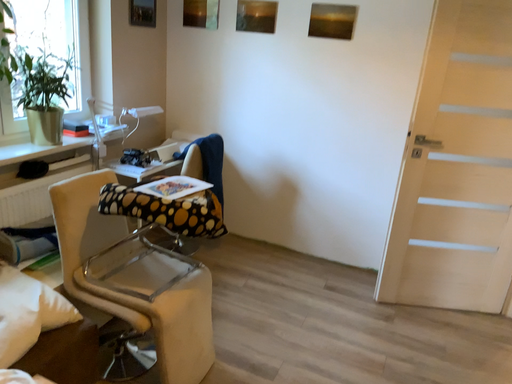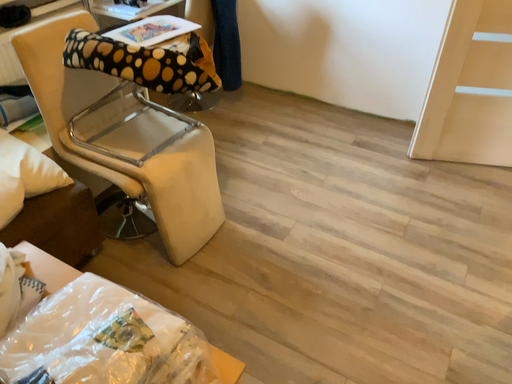
Question: Which way did the camera rotate in the video?

Choices:
 (A) rotated right
 (B) rotated left

Answer: (B)